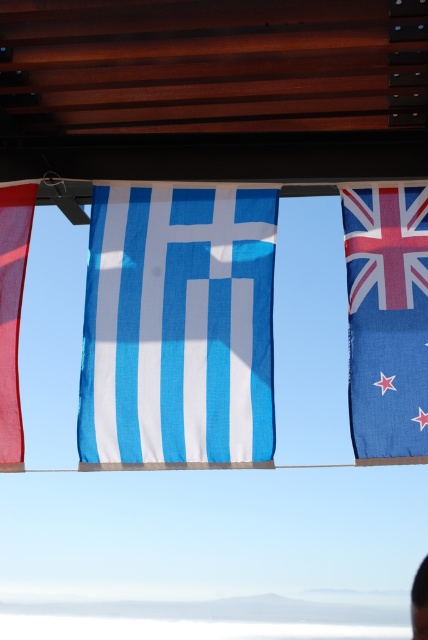
Question: Which of the following is the farthest from the observer?

Choices:
 (A) blue fabric flag at right
 (B) black plastic person at lower right
 (C) matte red flag at left

Answer: (C)

Question: Is blue fabric flag at center further to the viewer compared to black plastic person at lower right?

Choices:
 (A) no
 (B) yes

Answer: (B)

Question: Among these points, which one is nearest to the camera?

Choices:
 (A) (130, 340)
 (B) (418, 598)
 (C) (5, 417)

Answer: (B)

Question: Which point is farther to the camera?

Choices:
 (A) [15, 339]
 (B) [419, 625]
 (C) [240, 371]

Answer: (A)

Question: Is blue fabric flag at center smaller than blue fabric flag at right?

Choices:
 (A) no
 (B) yes

Answer: (A)

Question: Does blue fabric flag at center have a greater width compared to black plastic person at lower right?

Choices:
 (A) yes
 (B) no

Answer: (A)